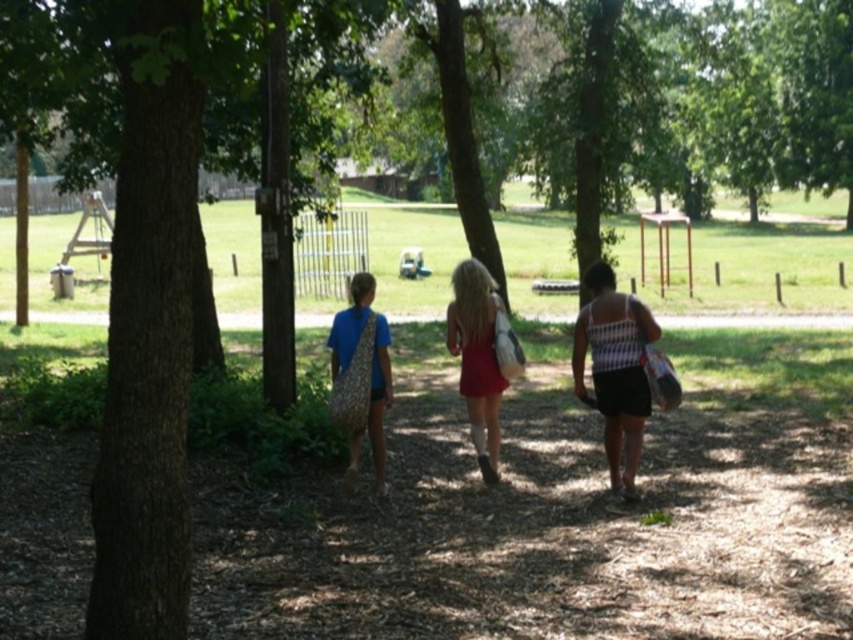
What do you see at coordinates (614, 369) in the screenshot? I see `white textured tank top at center` at bounding box center [614, 369].

Does point (579, 310) come closer to viewer compared to point (50, 316)?

Yes.

The image size is (853, 640). Describe the element at coordinates (614, 369) in the screenshot. I see `white textured tank top at center` at that location.

This screenshot has width=853, height=640. Identify the location of white textured tank top at center. (614, 369).

Does white textured tank top at center have a lesser height compared to matte red dress at center?

No, white textured tank top at center is not shorter than matte red dress at center.

Which of these two, white textured tank top at center or matte red dress at center, stands taller?

With more height is white textured tank top at center.

Locate an element on the screen. Image resolution: width=853 pixels, height=640 pixels. white textured tank top at center is located at coordinates (614, 369).

Based on the photo, can you confirm if matte blue shirt at center is positioned to the left of brown dirt path at center?

In fact, matte blue shirt at center is to the right of brown dirt path at center.

Between point (351, 356) and point (686, 323), which one is positioned behind?

The point (686, 323) is behind.

Locate an element on the screen. This screenshot has width=853, height=640. matte blue shirt at center is located at coordinates (x=370, y=372).